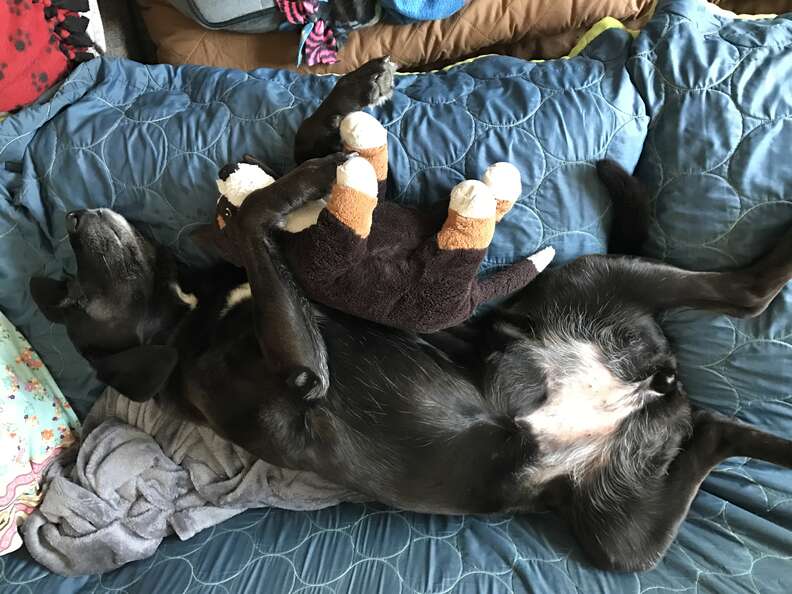
Where is `chest`? This screenshot has height=594, width=792. chest is located at coordinates (256, 350).